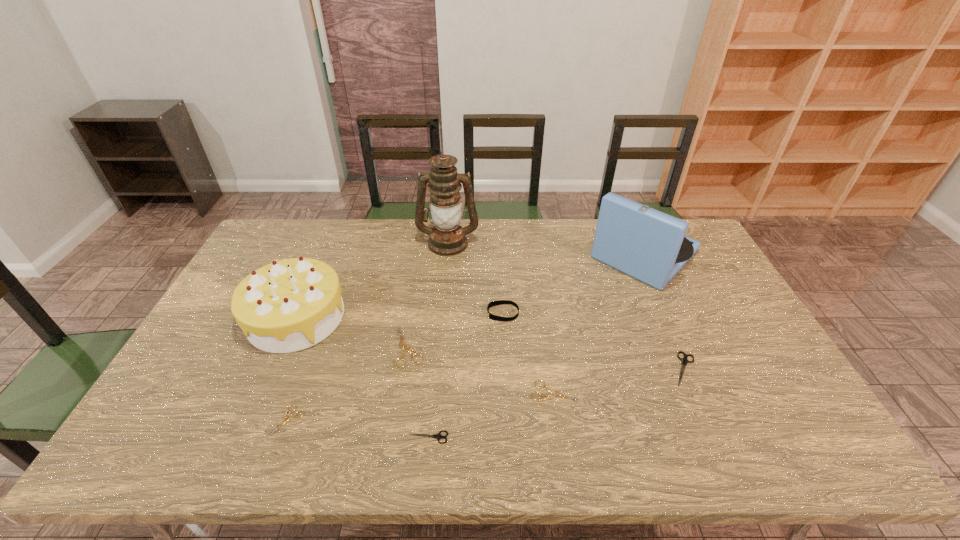
Locate which beige shears is the closest to the third object from right to left. Please provide its 2D coordinates. Your answer should be formatted as a tuple, i.e. [(x, y)], where the tuple contains the x and y coordinates of a point satisfying the conditions above.

[(403, 347)]

Select which beige shears is the second closest to the bigger black shears. Please provide its 2D coordinates. Your answer should be formatted as a tuple, i.e. [(x, y)], where the tuple contains the x and y coordinates of a point satisfying the conditions above.

[(403, 347)]

Locate an element on the screen. The width and height of the screenshot is (960, 540). free spot that satisfies the following two spatial constraints: 1. on the display of the sixth object from left to right; 2. on the left side of the second nearest beige shears is located at coordinates (507, 392).

Image resolution: width=960 pixels, height=540 pixels. I want to click on blank area in the image that satisfies the following two spatial constraints: 1. on the back side of the tallest object; 2. on the right side of the smaller black shears, so click(446, 242).

Image resolution: width=960 pixels, height=540 pixels. Find the location of `free space that satisfies the following two spatial constraints: 1. on the back side of the leftmost beige shears; 2. on the left side of the farthest beige shears`. free space that satisfies the following two spatial constraints: 1. on the back side of the leftmost beige shears; 2. on the left side of the farthest beige shears is located at coordinates (314, 347).